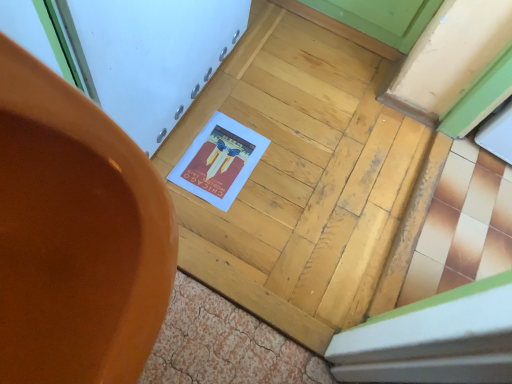
Describe the element at coordinates (75, 235) in the screenshot. I see `matte orange pot at center` at that location.

This screenshot has height=384, width=512. In order to click on matte orange pot at center in this screenshot , I will do `click(75, 235)`.

I want to click on wooden door at center, so click(308, 177).

What do you see at coordinates (308, 177) in the screenshot? This screenshot has height=384, width=512. I see `wooden door at center` at bounding box center [308, 177].

Image resolution: width=512 pixels, height=384 pixels. In order to click on matte orange pot at center in this screenshot , I will do `click(75, 235)`.

Does matte orange pot at center appear on the left side of wooden door at center?

Yes, matte orange pot at center is to the left of wooden door at center.

Considering their positions, is matte orange pot at center located in front of or behind wooden door at center?

In the image, matte orange pot at center appears in front of wooden door at center.

Does point (31, 290) lie in front of point (188, 200)?

Yes.

From the image's perspective, is matte orange pot at center positioned above or below wooden door at center?

matte orange pot at center is situated lower than wooden door at center in the image.

From a real-world perspective, does matte orange pot at center sit lower than wooden door at center?

No, from a real-world perspective, matte orange pot at center is not under wooden door at center.

Is matte orange pot at center wider or thinner than wooden door at center?

matte orange pot at center is thinner than wooden door at center.

Is matte orange pot at center shorter than wooden door at center?

No, matte orange pot at center is not shorter than wooden door at center.

Is matte orange pot at center bigger than wooden door at center?

Yes, matte orange pot at center is bigger than wooden door at center.

Can wooden door at center be found inside matte orange pot at center?

No, wooden door at center is located outside of matte orange pot at center.

Would you say matte orange pot at center is a long distance from wooden door at center?

That's not correct — matte orange pot at center is a little close to wooden door at center.

Is matte orange pot at center looking in the opposite direction of wooden door at center?

matte orange pot at center is not turned away from wooden door at center.

The image size is (512, 384). I want to click on door behind the matte orange pot at center, so click(308, 177).

Does wooden door at center appear on the right side of matte orange pot at center?

Yes, wooden door at center is to the right of matte orange pot at center.

Relative to matte orange pot at center, is wooden door at center in front or behind?

wooden door at center is positioned farther from the viewer than matte orange pot at center.

Which is more distant, (278, 308) or (135, 300)?

The point (278, 308) is more distant.

From the image's perspective, is wooden door at center located above matte orange pot at center?

Yes, from the image's perspective, wooden door at center is on top of matte orange pot at center.

From a real-world perspective, which is physically above, wooden door at center or matte orange pot at center?

matte orange pot at center, from a real-world perspective.

Looking at their sizes, would you say wooden door at center is wider or thinner than matte orange pot at center?

Clearly, wooden door at center has more width compared to matte orange pot at center.

Is wooden door at center taller than matte orange pot at center?

In fact, wooden door at center may be shorter than matte orange pot at center.

Considering the sizes of objects wooden door at center and matte orange pot at center in the image provided, who is smaller, wooden door at center or matte orange pot at center?

Smaller between the two is wooden door at center.

Is wooden door at center completely or partially outside of matte orange pot at center?

wooden door at center is positioned outside matte orange pot at center.

Is wooden door at center next to matte orange pot at center and touching it?

They are not placed beside each other.

Is wooden door at center turned away from matte orange pot at center?

That's not correct — wooden door at center is not looking away from matte orange pot at center.

How different are the orientations of wooden door at center and matte orange pot at center in degrees?

They differ by 86.7 degrees in their facing directions.

How distant is wooden door at center from matte orange pot at center?

wooden door at center is 96.47 centimeters from matte orange pot at center.

This screenshot has height=384, width=512. I want to click on chair in front of the wooden door at center, so click(x=75, y=235).

Image resolution: width=512 pixels, height=384 pixels. What are the coordinates of `door located above the matte orange pot at center (from the image's perspective)` in the screenshot? It's located at (308, 177).

Locate an element on the screen. The image size is (512, 384). chair on the left of wooden door at center is located at coordinates (75, 235).